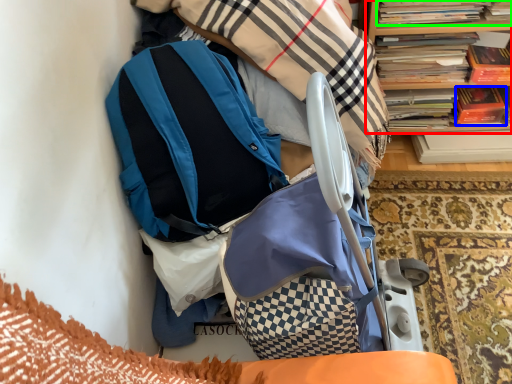
Question: Considering the real-world distances, which object is farthest from bookcase (highlighted by a red box)? paperback book (highlighted by a blue box) or book (highlighted by a green box)?

Choices:
 (A) paperback book
 (B) book

Answer: (A)